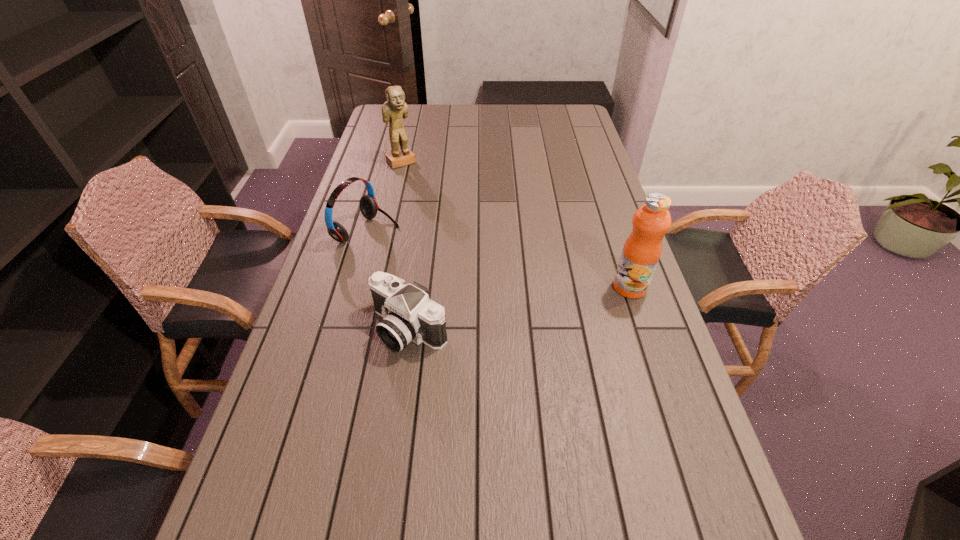
Locate an element on the screen. vacant spot on the desktop that is between the camera and the second nearest object and is positioned on the front-facing side of the figurine is located at coordinates (537, 305).

Locate an element on the screen. The width and height of the screenshot is (960, 540). free space on the desktop that is between the nearest object and the rightmost object and is positioned with the microphone attached to the side of the third tallest object is located at coordinates (556, 301).